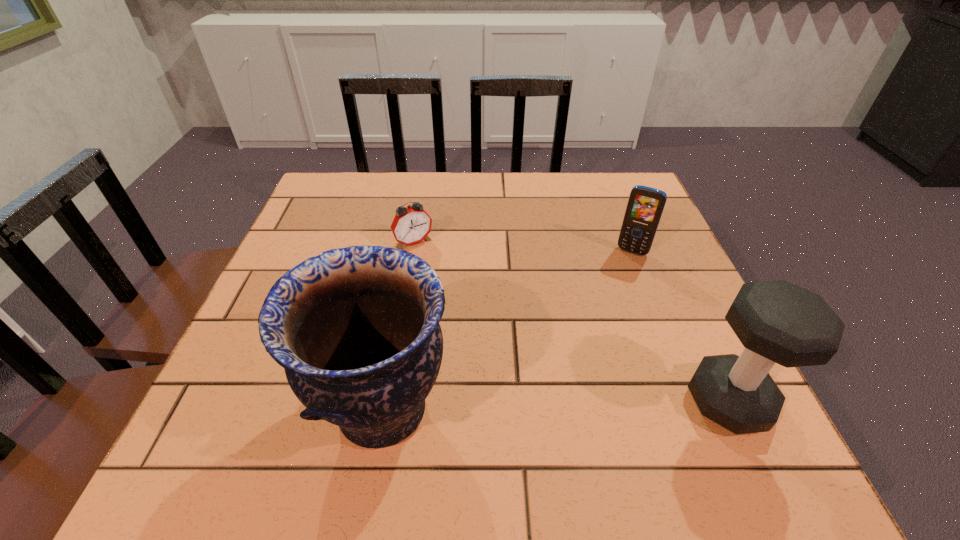
The width and height of the screenshot is (960, 540). Find the location of `free space on the desktop that is between the pottery and the dumbbell and is positioned on the screen of the cellular telephone`. free space on the desktop that is between the pottery and the dumbbell and is positioned on the screen of the cellular telephone is located at coordinates (563, 405).

The height and width of the screenshot is (540, 960). In order to click on vacant space on the desktop that is between the pottery and the dumbbell and is positioned on the clock face of the shortest object in this screenshot , I will do `click(524, 406)`.